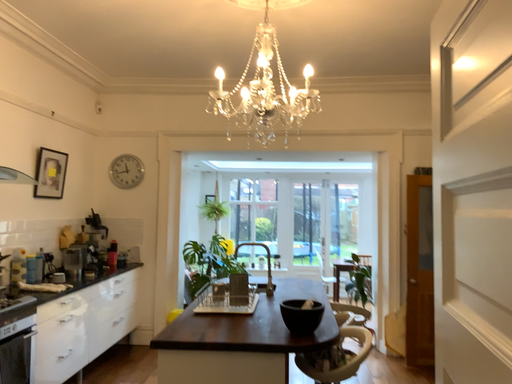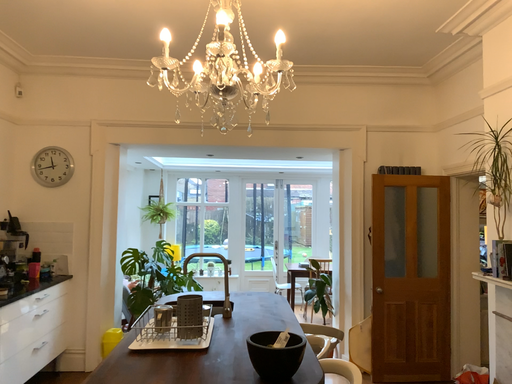
Question: Which way did the camera rotate in the video?

Choices:
 (A) rotated left
 (B) rotated right

Answer: (B)